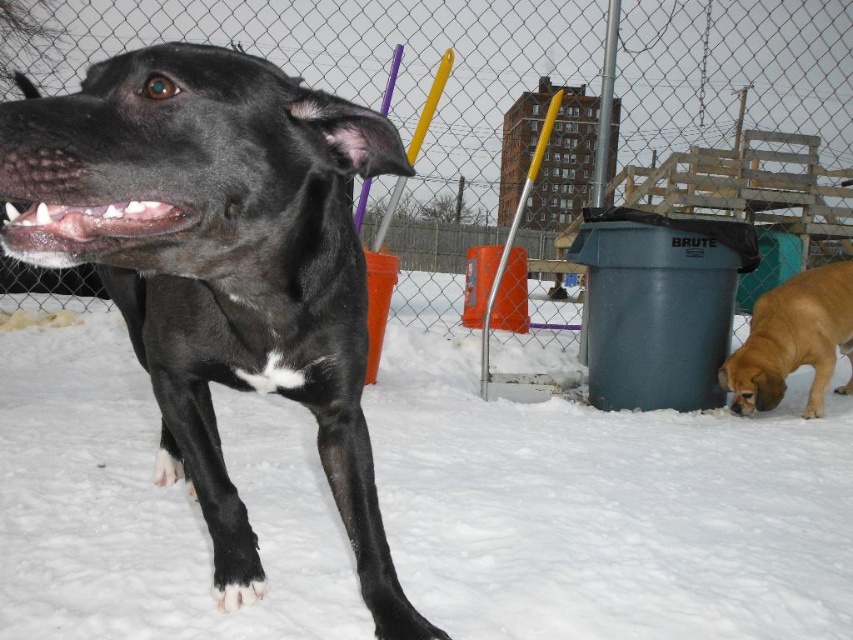
Between white fluffy snow at lower left and golden brown fur at lower right, which one appears on the right side from the viewer's perspective?

From the viewer's perspective, golden brown fur at lower right appears more on the right side.

Who is more distant from viewer, (396, 337) or (849, 308)?

Positioned behind is point (396, 337).

You are a GUI agent. You are given a task and a screenshot of the screen. Output one action in this format:
    pyautogui.click(x=<x>, y=<y>)
    Task: Click on the white fluffy snow at lower left
    This screenshot has width=853, height=640.
    Given the screenshot: What is the action you would take?
    pyautogui.click(x=607, y=509)

Is white fluffy snow at lower left smaller than metal chain-link fence at upper center?

Correct, white fluffy snow at lower left occupies less space than metal chain-link fence at upper center.

Can you confirm if white fluffy snow at lower left is thinner than metal chain-link fence at upper center?

Yes, white fluffy snow at lower left is thinner than metal chain-link fence at upper center.

Where is `white fluffy snow at lower left`? This screenshot has height=640, width=853. white fluffy snow at lower left is located at coordinates 607,509.

Does point (281, 572) come farther from viewer compared to point (245, 154)?

Yes, it is.

Between white fluffy snow at lower left and black glossy dog at left, which one is positioned higher?

Positioned higher is black glossy dog at left.

Who is more forward, (752, 470) or (354, 141)?

Point (354, 141) is in front.

Locate an element on the screen. white fluffy snow at lower left is located at coordinates (607, 509).